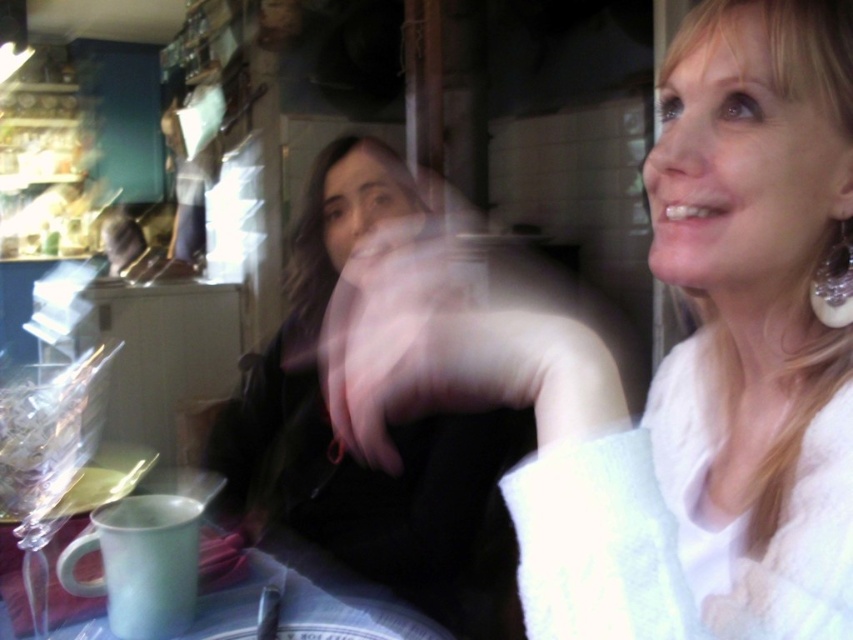
Question: Can you confirm if white fuzzy sweater at upper right is smaller than white fluffy robe at upper right?

Choices:
 (A) yes
 (B) no

Answer: (B)

Question: From the image, what is the correct spatial relationship of white fuzzy sweater at upper right in relation to smooth black hand at center?

Choices:
 (A) right
 (B) left

Answer: (A)

Question: Among these points, which one is farthest from the camera?

Choices:
 (A) (280, 403)
 (B) (683, 349)
 (C) (451, 340)

Answer: (A)

Question: Which of the following is the closest to the observer?

Choices:
 (A) (614, 509)
 (B) (786, 522)
 (C) (399, 481)

Answer: (A)

Question: Does white fuzzy sweater at upper right appear under white fluffy robe at upper right?

Choices:
 (A) yes
 (B) no

Answer: (B)

Question: Which object is farther from the camera taking this photo?

Choices:
 (A) white fuzzy sweater at upper right
 (B) smooth black hand at center
 (C) white fluffy robe at upper right

Answer: (B)